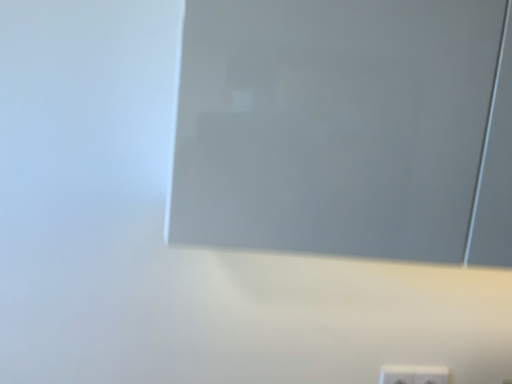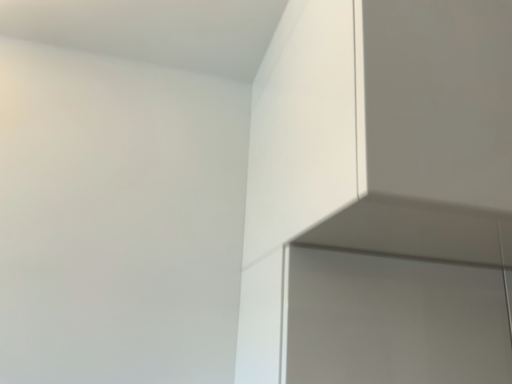
Question: How did the camera likely rotate when shooting the video?

Choices:
 (A) rotated upward
 (B) rotated downward

Answer: (A)